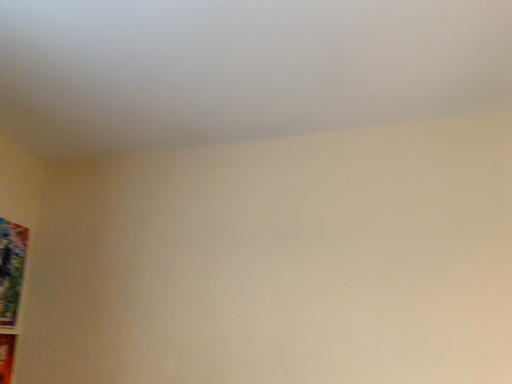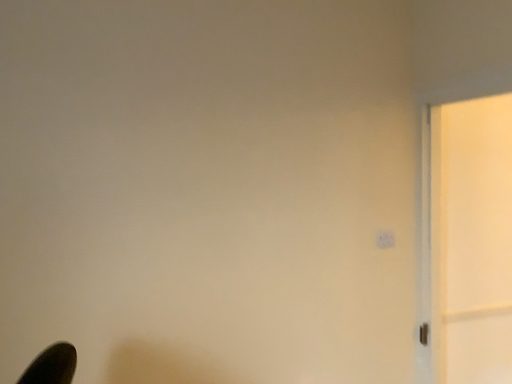
Question: How did the camera likely rotate when shooting the video?

Choices:
 (A) rotated upward
 (B) rotated downward

Answer: (B)